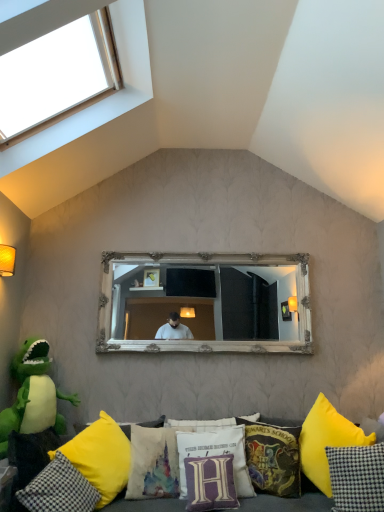
Image resolution: width=384 pixels, height=512 pixels. What do you see at coordinates (326, 441) in the screenshot? I see `yellow fabric pillow at lower right, the second pillow from the right` at bounding box center [326, 441].

What is the approximate height of white fabric pillow with purple lettering at center, the fifth pillow positioned from the left?

15.90 inches.

Find the location of a particular element. The image size is (384, 512). yellow fabric pillow at lower left, placed as the eighth pillow when sorted from right to left is located at coordinates (59, 489).

What do you see at coordinates (59, 489) in the screenshot? I see `yellow fabric pillow at lower left, placed as the eighth pillow when sorted from right to left` at bounding box center [59, 489].

Locate an element on the screen. This screenshot has height=512, width=384. clear glass window at upper left is located at coordinates (109, 69).

Describe the element at coordinates (210, 483) in the screenshot. I see `purple velvet pillow at center, which is the 5th pillow from right to left` at that location.

Where is `green plush toy at lower left`? The height and width of the screenshot is (512, 384). green plush toy at lower left is located at coordinates (33, 395).

Is watercolor fabric pillow at center, which is counted as the sixth pillow, starting from the right, spatially inside yellow fabric pillow at lower center, which appears as the second pillow when viewed from the left, or outside of it?

watercolor fabric pillow at center, which is counted as the sixth pillow, starting from the right, is contained in yellow fabric pillow at lower center, which appears as the second pillow when viewed from the left.

Does watercolor fabric pillow at center, which is counted as the sixth pillow, starting from the right, appear on the left side of yellow fabric pillow at lower center, positioned as the 7th pillow in right-to-left order?

No.

Is point (137, 461) closer or farther from the camera than point (117, 433)?

Point (137, 461).

Looking at their sizes, would you say watercolor fabric pillow at center, which is counted as the sixth pillow, starting from the right, is wider or thinner than yellow fabric pillow at lower center, which appears as the second pillow when viewed from the left?

Clearly, watercolor fabric pillow at center, which is counted as the sixth pillow, starting from the right, has less width compared to yellow fabric pillow at lower center, which appears as the second pillow when viewed from the left.

Is checkered fabric pillow at lower right, positioned as the eighth pillow in left-to-right order, in front of or behind white fabric pillow with purple lettering at center, marked as the fourth pillow in a right-to-left arrangement, in the image?

Visually, checkered fabric pillow at lower right, positioned as the eighth pillow in left-to-right order, is located in front of white fabric pillow with purple lettering at center, marked as the fourth pillow in a right-to-left arrangement.

Which is correct: checkered fabric pillow at lower right, positioned as the eighth pillow in left-to-right order, is inside white fabric pillow with purple lettering at center, the fifth pillow positioned from the left, or outside of it?

checkered fabric pillow at lower right, positioned as the eighth pillow in left-to-right order, is not inside white fabric pillow with purple lettering at center, the fifth pillow positioned from the left, it's outside.

Identify the location of the 5th pillow above when counting from the white fabric pillow with purple lettering at center, the fifth pillow positioned from the left (from the image's perspective). The width and height of the screenshot is (384, 512). (357, 477).

Could you tell me if checkered fabric pillow at lower right, positioned as the eighth pillow in left-to-right order, is turned towards white fabric pillow with purple lettering at center, marked as the fourth pillow in a right-to-left arrangement?

No, checkered fabric pillow at lower right, positioned as the eighth pillow in left-to-right order, is not aimed at white fabric pillow with purple lettering at center, marked as the fourth pillow in a right-to-left arrangement.

From the picture: From a real-world perspective, which is physically below, purple velvet pillow at center, the fourth pillow viewed from the left, or yellow fabric pillow at lower center, which appears as the second pillow when viewed from the left?

purple velvet pillow at center, the fourth pillow viewed from the left, from a real-world perspective.

Is purple velvet pillow at center, which is the 5th pillow from right to left, closer to the viewer compared to yellow fabric pillow at lower center, positioned as the 7th pillow in right-to-left order?

No, purple velvet pillow at center, which is the 5th pillow from right to left, is further to the viewer.

Based on their sizes in the image, would you say purple velvet pillow at center, the fourth pillow viewed from the left, is bigger or smaller than yellow fabric pillow at lower center, positioned as the 7th pillow in right-to-left order?

purple velvet pillow at center, the fourth pillow viewed from the left, is smaller than yellow fabric pillow at lower center, positioned as the 7th pillow in right-to-left order.

In terms of height, does purple velvet pillow at center, the fourth pillow viewed from the left, look taller or shorter compared to yellow fabric pillow at lower center, which appears as the second pillow when viewed from the left?

Considering their sizes, purple velvet pillow at center, the fourth pillow viewed from the left, has less height than yellow fabric pillow at lower center, which appears as the second pillow when viewed from the left.

Between yellow fabric pillow at lower right, the second pillow from the right, and matte yellow wall sconce at left, which one has smaller size?

matte yellow wall sconce at left is smaller.

Is yellow fabric pillow at lower right, the second pillow from the right, taller than matte yellow wall sconce at left?

Yes.

Does yellow fabric pillow at lower right, the second pillow from the right, have a greater width compared to matte yellow wall sconce at left?

Yes, yellow fabric pillow at lower right, the second pillow from the right, is wider than matte yellow wall sconce at left.

Which object is thinner, yellow fabric pillow at lower left, placed as the eighth pillow when sorted from right to left, or velvet hogwarts school crest pillow at center, marked as the 6th pillow in a left-to-right arrangement?

Thinner between the two is velvet hogwarts school crest pillow at center, marked as the 6th pillow in a left-to-right arrangement.

Is point (64, 500) positioned after point (289, 451)?

No, (64, 500) is closer to viewer.

Is yellow fabric pillow at lower left, placed as the eighth pillow when sorted from right to left, closer to camera compared to velvet hogwarts school crest pillow at center, the 3th pillow from the right?

Yes, the depth of yellow fabric pillow at lower left, placed as the eighth pillow when sorted from right to left, is less than that of velvet hogwarts school crest pillow at center, the 3th pillow from the right.

From a real-world perspective, which object stands above the other?

velvet hogwarts school crest pillow at center, marked as the 6th pillow in a left-to-right arrangement, is physically above.

Is green plush toy at lower left smaller than checkered fabric pillow at lower right, which is the 1th pillow from right to left?

No, green plush toy at lower left is not smaller than checkered fabric pillow at lower right, which is the 1th pillow from right to left.

Does green plush toy at lower left lie behind checkered fabric pillow at lower right, which is the 1th pillow from right to left?

Yes, green plush toy at lower left is further from the camera.

Is green plush toy at lower left far from checkered fabric pillow at lower right, which is the 1th pillow from right to left?

Indeed, green plush toy at lower left is not near checkered fabric pillow at lower right, which is the 1th pillow from right to left.

Which is nearer, [32,346] or [358,484]?

Point [358,484]

Can white fabric pillow with purple lettering at center, the fifth pillow positioned from the left, be found inside yellow fabric pillow at lower right, the second pillow from the right?

No, white fabric pillow with purple lettering at center, the fifth pillow positioned from the left, is not inside yellow fabric pillow at lower right, the second pillow from the right.

Is yellow fabric pillow at lower right, placed as the 7th pillow when sorted from left to right, oriented away from white fabric pillow with purple lettering at center, the fifth pillow positioned from the left?

yellow fabric pillow at lower right, placed as the 7th pillow when sorted from left to right, does not have its back to white fabric pillow with purple lettering at center, the fifth pillow positioned from the left.

Considering the positions of points (367, 444) and (200, 434), is point (367, 444) closer to camera compared to point (200, 434)?

Yes, it is.

The image size is (384, 512). Find the location of `the 1st pillow counting from the right of the yellow fabric pillow at lower center, positioned as the 7th pillow in right-to-left order`. the 1st pillow counting from the right of the yellow fabric pillow at lower center, positioned as the 7th pillow in right-to-left order is located at coordinates (154, 462).

There is a checkered fabric pillow at lower right, positioned as the eighth pillow in left-to-right order. In order to click on the 1st pillow below it (from a real-world perspective) in this screenshot , I will do `click(216, 453)`.

Based on their spatial positions, is checkered fabric pillow at lower right, which is the 1th pillow from right to left, or yellow fabric pillow at lower center, which appears as the second pillow when viewed from the left, further from yellow fabric couch at lower center?

checkered fabric pillow at lower right, which is the 1th pillow from right to left, is further to yellow fabric couch at lower center.

When comparing their distances from purple velvet pillow at center, the fourth pillow viewed from the left, does white fabric pillow with purple lettering at center, marked as the fourth pillow in a right-to-left arrangement, or yellow fabric couch at lower center seem further?

The object further to purple velvet pillow at center, the fourth pillow viewed from the left, is yellow fabric couch at lower center.

Considering their positions, is yellow fabric pillow at lower center, positioned as the 7th pillow in right-to-left order, positioned further to white fabric pillow with purple lettering at center, the fifth pillow positioned from the left, than checkered fabric pillow at lower right, which is the 1th pillow from right to left?

The object further to white fabric pillow with purple lettering at center, the fifth pillow positioned from the left, is checkered fabric pillow at lower right, which is the 1th pillow from right to left.

When comparing their distances from yellow fabric pillow at lower left, the 1th pillow in the left-to-right sequence, does green plush toy at lower left or checkered fabric pillow at lower right, positioned as the eighth pillow in left-to-right order, seem closer?

Based on the image, green plush toy at lower left appears to be nearer to yellow fabric pillow at lower left, the 1th pillow in the left-to-right sequence.

From the image, which object appears to be farther from yellow fabric pillow at lower left, placed as the eighth pillow when sorted from right to left, checkered fabric pillow at lower right, positioned as the eighth pillow in left-to-right order, or watercolor fabric pillow at center, which is counted as the sixth pillow, starting from the right?

checkered fabric pillow at lower right, positioned as the eighth pillow in left-to-right order.

Which object lies further to the anchor point matte yellow wall sconce at left, yellow fabric pillow at lower left, placed as the eighth pillow when sorted from right to left, or white fabric pillow with purple lettering at center, marked as the fourth pillow in a right-to-left arrangement?

white fabric pillow with purple lettering at center, marked as the fourth pillow in a right-to-left arrangement.

Based on the photo, considering their positions, is purple velvet pillow at center, which is the 5th pillow from right to left, positioned further to yellow fabric pillow at lower center, positioned as the 7th pillow in right-to-left order, than clear glass window at upper left?

Based on the image, clear glass window at upper left appears to be further to yellow fabric pillow at lower center, positioned as the 7th pillow in right-to-left order.

Looking at the image, which one is located further to checkered fabric pillow at lower right, which is the 1th pillow from right to left, yellow fabric couch at lower center or clear glass window at upper left?

clear glass window at upper left is further to checkered fabric pillow at lower right, which is the 1th pillow from right to left.

What are the coordinates of `studio couch between yellow fabric pillow at lower center, which appears as the second pillow when viewed from the left, and checkered fabric pillow at lower right, positioned as the eighth pillow in left-to-right order, in the horizontal direction` in the screenshot? It's located at (29, 459).

You are a GUI agent. You are given a task and a screenshot of the screen. Output one action in this format:
    pyautogui.click(x=<x>, y=<y>)
    Task: Click on the toy between clear glass window at upper left and white fabric pillow with purple lettering at center, marked as the fourth pillow in a right-to-left arrangement, in the vertical direction
    Image resolution: width=384 pixels, height=512 pixels.
    Given the screenshot: What is the action you would take?
    tap(33, 395)

Locate an element on the screen. light fixture between clear glass window at upper left and white ornate mirror at center vertically is located at coordinates (7, 260).

Find the location of a particular element. Image resolution: width=384 pixels, height=512 pixels. light fixture between clear glass window at upper left and yellow fabric pillow at lower left, the 1th pillow in the left-to-right sequence, vertically is located at coordinates (7, 260).